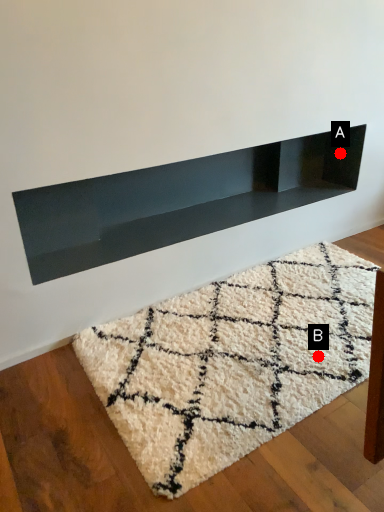
Question: Two points are circled on the image, labeled by A and B beside each circle. Which point is further to the camera?

Choices:
 (A) A is further
 (B) B is further

Answer: (A)